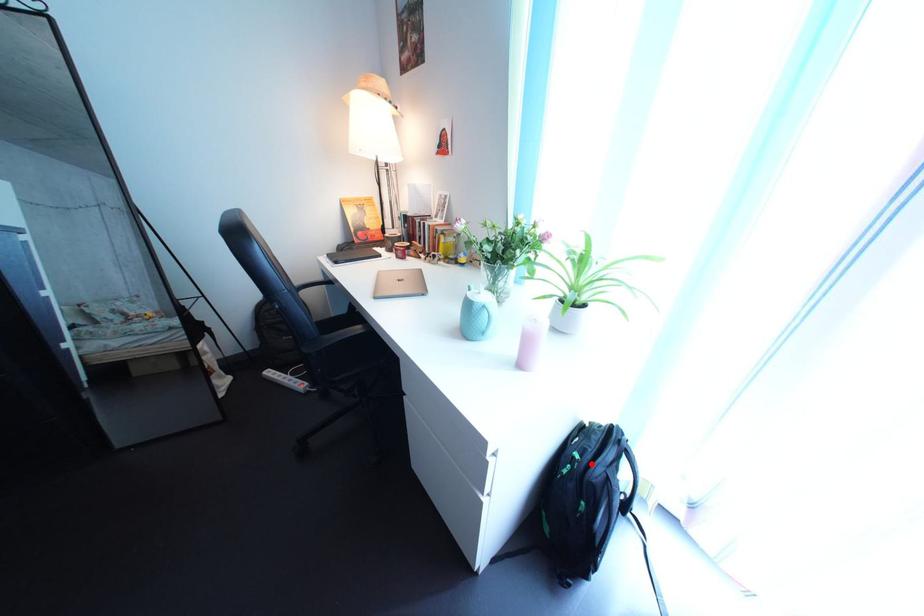
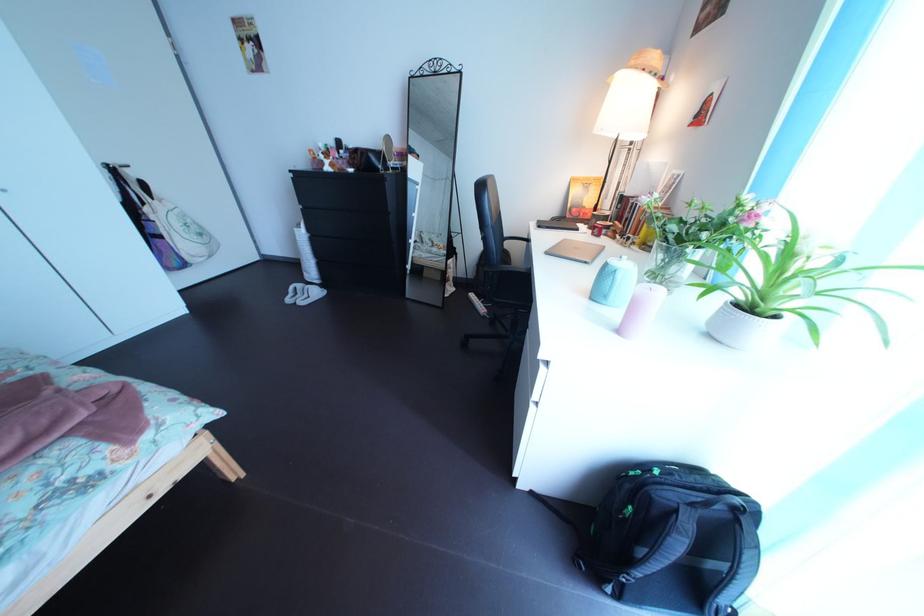
In the second image, find the point that corresponds to the highlighted location in the first image.

(672, 480)